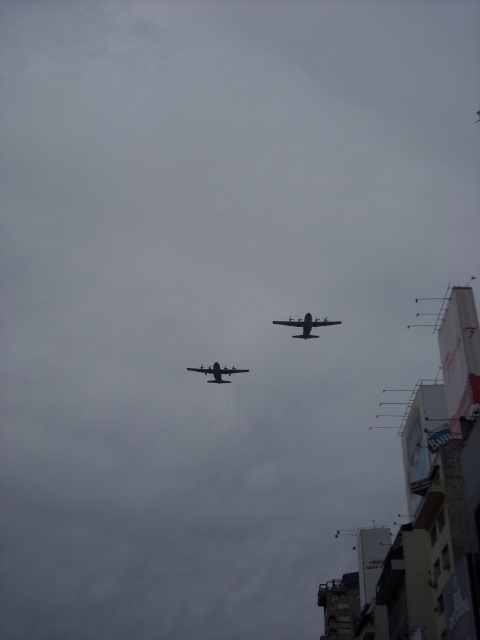
Does matte black airplane at upper center have a smaller size compared to metallic gray airplane at center?

No, matte black airplane at upper center is not smaller than metallic gray airplane at center.

Is the position of matte black airplane at upper center less distant than that of metallic gray airplane at center?

Yes, matte black airplane at upper center is in front of metallic gray airplane at center.

What do you see at coordinates (307, 324) in the screenshot?
I see `matte black airplane at upper center` at bounding box center [307, 324].

The image size is (480, 640). Find the location of `matte black airplane at upper center`. matte black airplane at upper center is located at coordinates (307, 324).